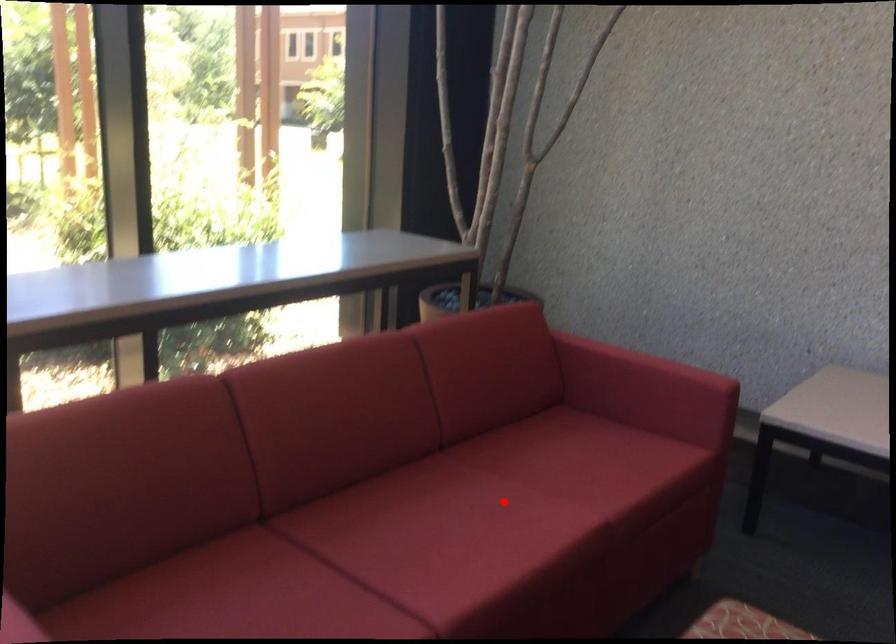
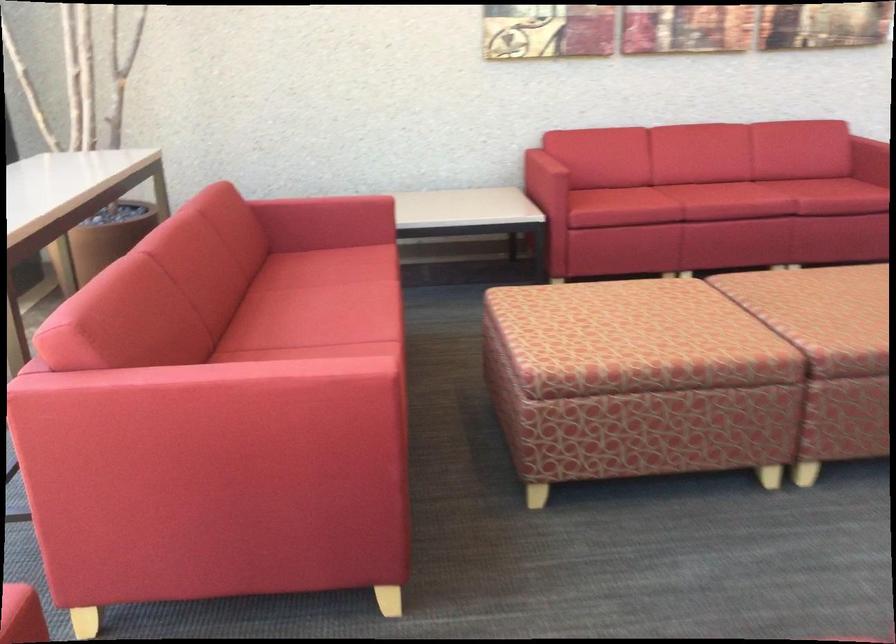
Question: I am providing you with two images of the same scene from different viewpoints. Image1 has a red point marked. In image2, the corresponding 3D location appears at what relative position? Reply with the corresponding letter.

Choices:
 (A) Closer
 (B) Farther

Answer: (B)